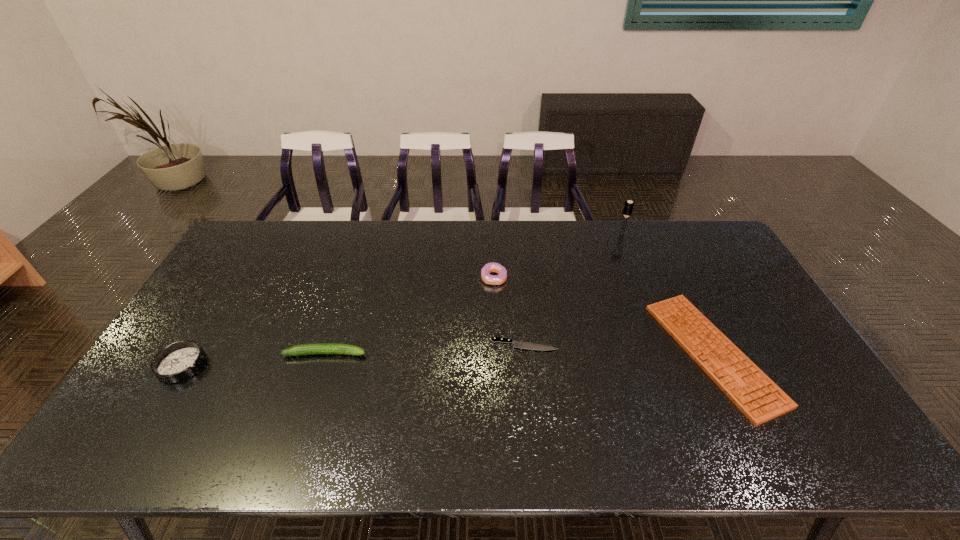
The height and width of the screenshot is (540, 960). Find the location of `the farthest object`. the farthest object is located at coordinates (628, 207).

What are the coordinates of `hairbrush` in the screenshot? It's located at (628, 207).

Identify the location of doughnut. This screenshot has width=960, height=540. (487, 278).

The image size is (960, 540). I want to click on the leftmost object, so click(178, 361).

You are a GUI agent. You are given a task and a screenshot of the screen. Output one action in this format:
    pyautogui.click(x=<x>, y=<y>)
    Task: Click on the second object from left to right
    The height and width of the screenshot is (540, 960).
    Given the screenshot: What is the action you would take?
    pyautogui.click(x=316, y=348)

Where is `the fifth tallest object`? This screenshot has height=540, width=960. the fifth tallest object is located at coordinates (746, 385).

This screenshot has height=540, width=960. I want to click on steak knife, so click(x=517, y=344).

The height and width of the screenshot is (540, 960). What are the coordinates of `vacant space located on the right of the farthest object` in the screenshot? It's located at (680, 233).

Locate an element on the screen. blank area located on the front of the fifth nearest object is located at coordinates (495, 321).

Locate an element on the screen. The image size is (960, 540). free point located 0.130m on the back of the leftmost object is located at coordinates (213, 314).